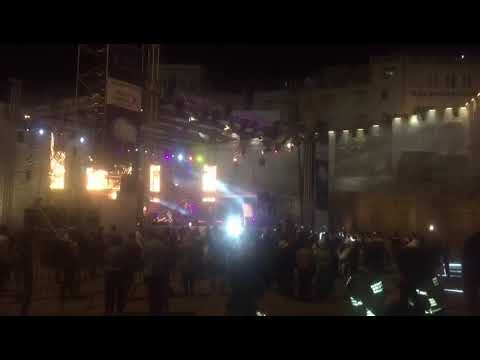
The height and width of the screenshot is (360, 480). I want to click on glowing orange lights, so click(57, 174), click(85, 181), click(156, 185), click(211, 177).